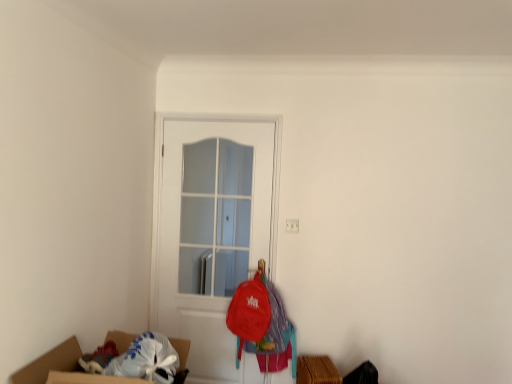
Locate an element on the screen. The image size is (512, 384). matte red backpack at center is located at coordinates (260, 320).

Describe the element at coordinates (260, 320) in the screenshot. I see `matte red backpack at center` at that location.

Describe the element at coordinates (211, 230) in the screenshot. I see `white glossy door at center` at that location.

Locate an element on the screen. The height and width of the screenshot is (384, 512). white glossy door at center is located at coordinates (211, 230).

Find the location of a particular element. Image resolution: width=512 pixels, height=384 pixels. matte red backpack at center is located at coordinates (260, 320).

Is white glossy door at center to the left of matte red backpack at center from the viewer's perspective?

Indeed, white glossy door at center is positioned on the left side of matte red backpack at center.

Is the position of white glossy door at center less distant than that of matte red backpack at center?

No, white glossy door at center is further to the viewer.

Is point (278, 155) positioned before point (261, 276)?

No.

From the image's perspective, relative to matte red backpack at center, is white glossy door at center above or below?

white glossy door at center is situated higher than matte red backpack at center in the image.

From a real-world perspective, which object rests below the other?

matte red backpack at center.

Considering the sizes of objects white glossy door at center and matte red backpack at center in the image provided, who is thinner, white glossy door at center or matte red backpack at center?

With smaller width is white glossy door at center.

Considering the sizes of objects white glossy door at center and matte red backpack at center in the image provided, who is shorter, white glossy door at center or matte red backpack at center?

Standing shorter between the two is matte red backpack at center.

Considering the sizes of objects white glossy door at center and matte red backpack at center in the image provided, who is smaller, white glossy door at center or matte red backpack at center?

matte red backpack at center.

Would you say white glossy door at center is inside or outside matte red backpack at center?

The correct answer is: outside.

Is white glossy door at center not close to matte red backpack at center?

That's not correct — white glossy door at center is a little close to matte red backpack at center.

Is white glossy door at center oriented away from matte red backpack at center?

Correct, white glossy door at center is looking away from matte red backpack at center.

How many degrees apart are the facing directions of white glossy door at center and matte red backpack at center?

white glossy door at center and matte red backpack at center are facing 0.0018 degrees away from each other.

Based on the photo, measure the distance from white glossy door at center to matte red backpack at center.

white glossy door at center and matte red backpack at center are 12.91 inches apart from each other.

I want to click on clothing on the right of white glossy door at center, so click(260, 320).

Considering the positions of objects matte red backpack at center and white glossy door at center in the image provided, who is more to the right, matte red backpack at center or white glossy door at center?

From the viewer's perspective, matte red backpack at center appears more on the right side.

Is matte red backpack at center closer to camera compared to white glossy door at center?

Yes, matte red backpack at center is closer to the viewer.

Considering the points (273, 315) and (196, 143), which point is in front, point (273, 315) or point (196, 143)?

The point (273, 315) is closer.

From the image's perspective, is matte red backpack at center beneath white glossy door at center?

Correct, matte red backpack at center appears lower than white glossy door at center in the image.

From a real-world perspective, who is located lower, matte red backpack at center or white glossy door at center?

In real-world perspective, matte red backpack at center is lower.

Which of these two, matte red backpack at center or white glossy door at center, is wider?

With larger width is matte red backpack at center.

Is matte red backpack at center taller than white glossy door at center?

No, matte red backpack at center is not taller than white glossy door at center.

Between matte red backpack at center and white glossy door at center, which one has larger size?

With larger size is white glossy door at center.

Is matte red backpack at center inside the boundaries of white glossy door at center, or outside?

matte red backpack at center exists outside the volume of white glossy door at center.

Is matte red backpack at center in contact with white glossy door at center?

No, matte red backpack at center is not in contact with white glossy door at center.

Is matte red backpack at center facing away from white glossy door at center?

Yes, matte red backpack at center is positioned with its back facing white glossy door at center.

What's the angular difference between matte red backpack at center and white glossy door at center's facing directions?

They differ by 0.0018 degrees in their facing directions.

The image size is (512, 384). What are the coordinates of `door that is behind the matte red backpack at center` in the screenshot? It's located at (211, 230).

This screenshot has height=384, width=512. I want to click on door on the left of matte red backpack at center, so click(211, 230).

Identify the location of door above the matte red backpack at center (from a real-world perspective). (211, 230).